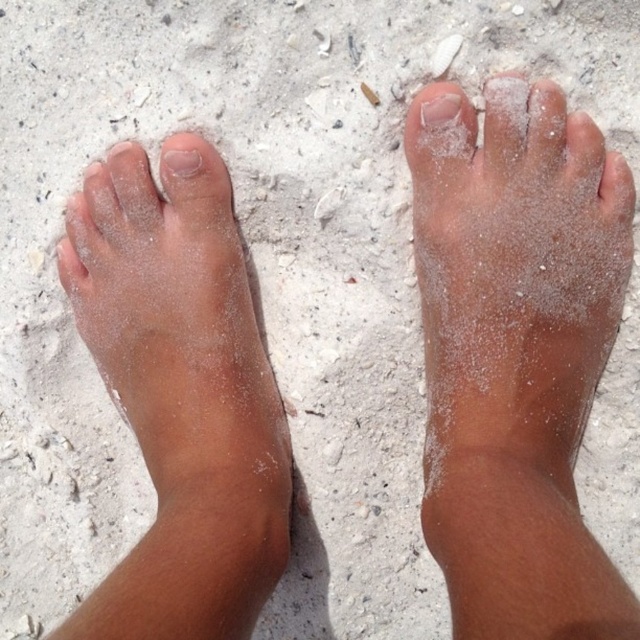
Consider the image. Which of these two, sandy skin foot at center or smooth skin toe at center, stands taller?

Standing taller between the two is sandy skin foot at center.

Which is behind, point (499, 77) or point (442, 108)?

The point (499, 77) is behind.

Does point (560, 365) come in front of point (428, 120)?

Yes.

Identify the location of sandy skin foot at center. This screenshot has width=640, height=640. coord(515,289).

Is point (442, 93) more distant than point (186, 170)?

That is False.

Is smooth skin toe at center positioned at the back of matte skin toe at center?

No, smooth skin toe at center is closer to the viewer.

Which is behind, point (452, 93) or point (161, 154)?

The point (161, 154) is behind.

What are the coordinates of `smooth skin toe at center` in the screenshot? It's located at (440, 108).

Who is shorter, sandy skin foot at center or sandy skin foot at left?

Standing shorter between the two is sandy skin foot at left.

Can you confirm if sandy skin foot at center is positioned below sandy skin foot at left?

Actually, sandy skin foot at center is above sandy skin foot at left.

Where is `sandy skin foot at center`? sandy skin foot at center is located at coordinates (515, 289).